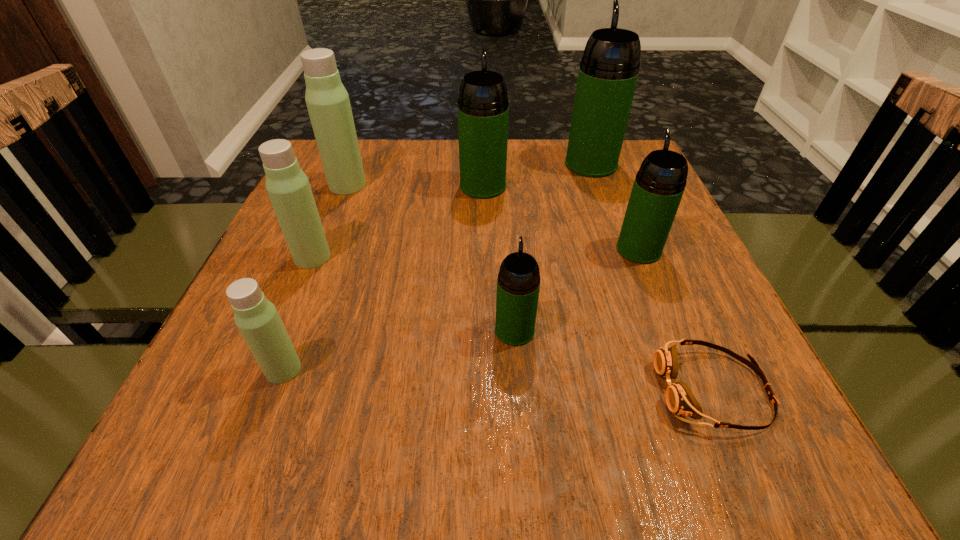
Locate an element on the screen. The height and width of the screenshot is (540, 960). object that is at the far left corner is located at coordinates tap(328, 104).

I want to click on object that is at the far right corner, so click(x=608, y=72).

Find the location of `object that is at the near right corner`. object that is at the near right corner is located at coordinates (x=680, y=400).

Locate an element on the screen. free space at the far edge of the desktop is located at coordinates (429, 145).

Image resolution: width=960 pixels, height=540 pixels. What are the coordinates of `vacant space at the near edge of the desktop` in the screenshot? It's located at (372, 444).

This screenshot has width=960, height=540. In the image, there is a desktop. Find the location of `vacant region at the left edge`. vacant region at the left edge is located at coordinates (292, 316).

In the image, there is a desktop. In order to click on vacant space at the right edge in this screenshot , I will do `click(683, 253)`.

Where is `free space at the far left corner of the desktop`? The width and height of the screenshot is (960, 540). free space at the far left corner of the desktop is located at coordinates (365, 139).

This screenshot has height=540, width=960. In the image, there is a desktop. Find the location of `vacant space at the near left corner`. vacant space at the near left corner is located at coordinates click(x=254, y=434).

This screenshot has height=540, width=960. What are the coordinates of `vacant area at the far right corner` in the screenshot? It's located at (624, 153).